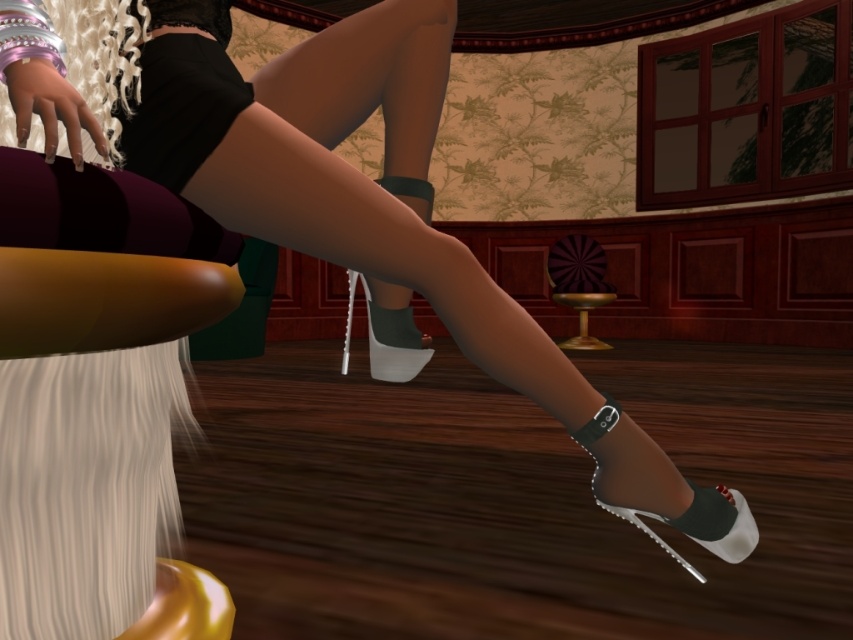
Question: Among these points, which one is nearest to the camera?

Choices:
 (A) [422, 340]
 (B) [715, 520]

Answer: (B)

Question: Which point is closer to the camera taking this photo?

Choices:
 (A) (717, 499)
 (B) (387, 310)

Answer: (A)

Question: Is black matte sock at lower right further to camera compared to dark green fabric sock at center?

Choices:
 (A) no
 (B) yes

Answer: (A)

Question: Which point is closer to the camera taking this photo?

Choices:
 (A) (424, 340)
 (B) (683, 528)

Answer: (B)

Question: Does black matte sock at lower right appear on the left side of dark green fabric sock at center?

Choices:
 (A) yes
 (B) no

Answer: (B)

Question: Can you confirm if black matte sock at lower right is wider than dark green fabric sock at center?

Choices:
 (A) no
 (B) yes

Answer: (B)